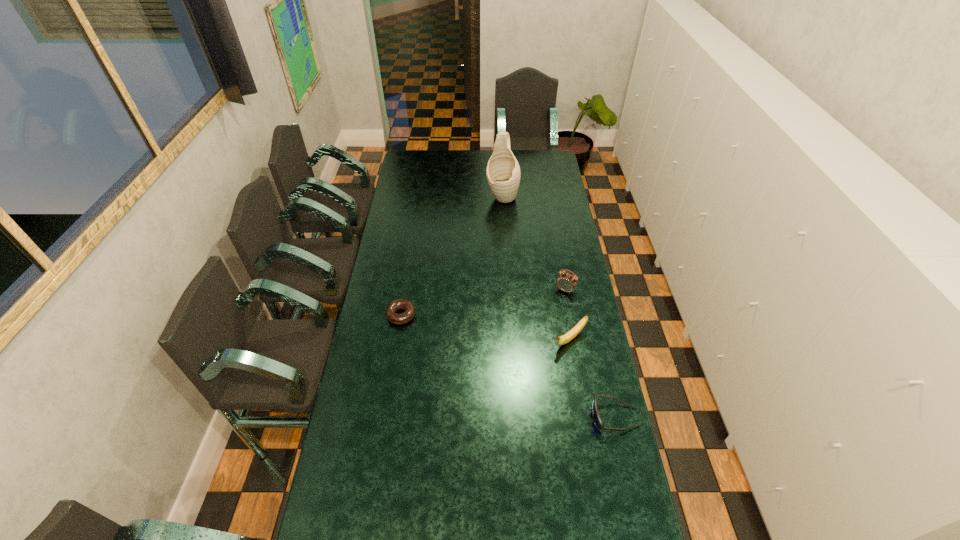
What are the coordinates of `vacant space on the desktop that is between the shortest object and the sunglasses and is positioned on the face of the alarm clock` in the screenshot? It's located at (516, 370).

Locate an element on the screen. vacant space on the desktop that is between the third nearest object and the sunglasses and is positioned at the spout of the pitcher is located at coordinates (475, 350).

Image resolution: width=960 pixels, height=540 pixels. In order to click on free spot on the desktop that is between the doughnut and the second shortest object and is positioned at the stem of the second nearest object in this screenshot , I will do `click(526, 374)`.